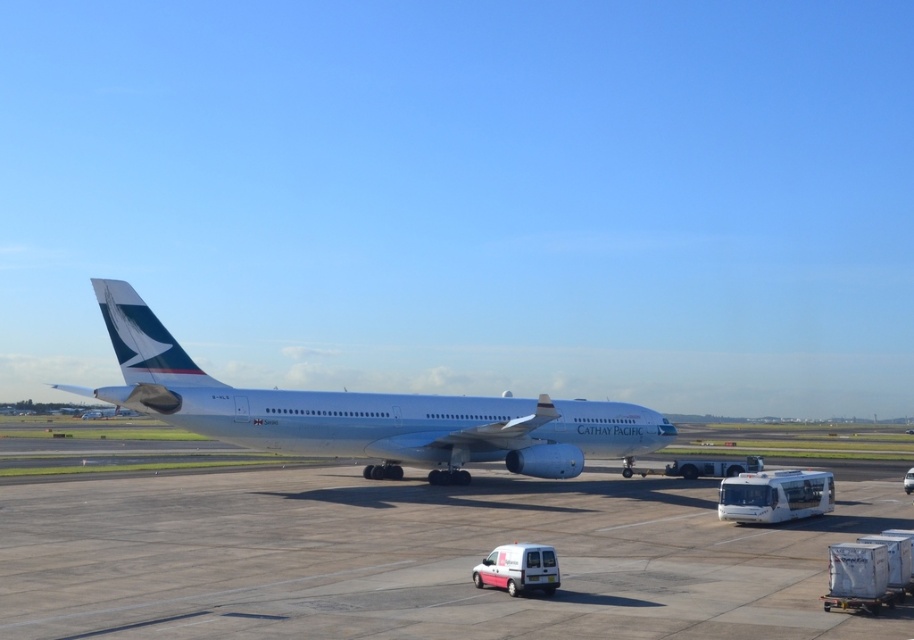
Does smooth concrete tarmac at center have a lesser width compared to silver metallic airplane at center?

Indeed, smooth concrete tarmac at center has a lesser width compared to silver metallic airplane at center.

Is smooth concrete tarmac at center above silver metallic airplane at center?

No, smooth concrete tarmac at center is not above silver metallic airplane at center.

The height and width of the screenshot is (640, 914). What are the coordinates of `smooth concrete tarmac at center` in the screenshot? It's located at (420, 556).